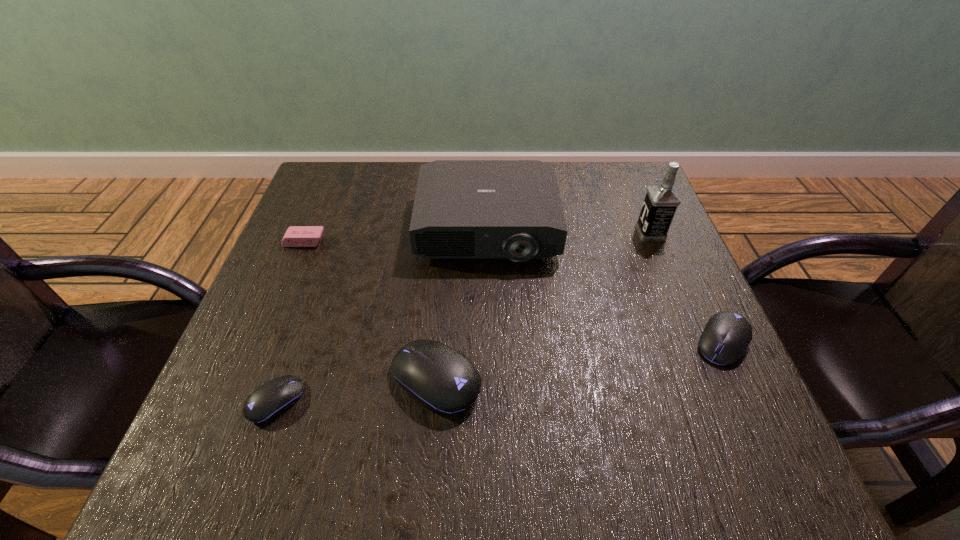
If we want them evenly spaced by inserting an extra mouse_(computer_equipment) among them, please locate a free spot for this new mouse_(computer_equipment). Please provide its 2D coordinates. Your answer should be formatted as a tuple, i.e. [(x, y)], where the tuple contains the x and y coordinates of a point satisfying the conditions above.

[(585, 360)]